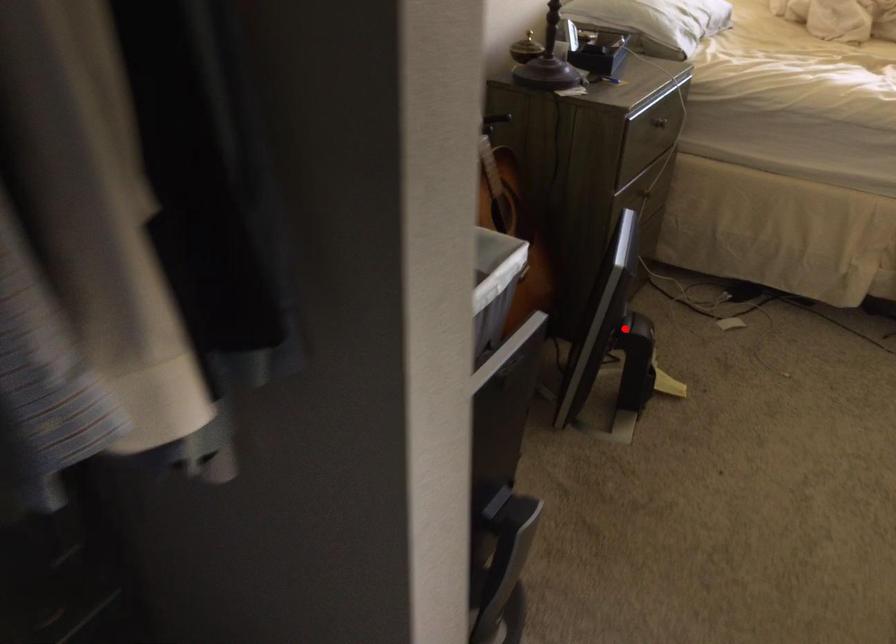
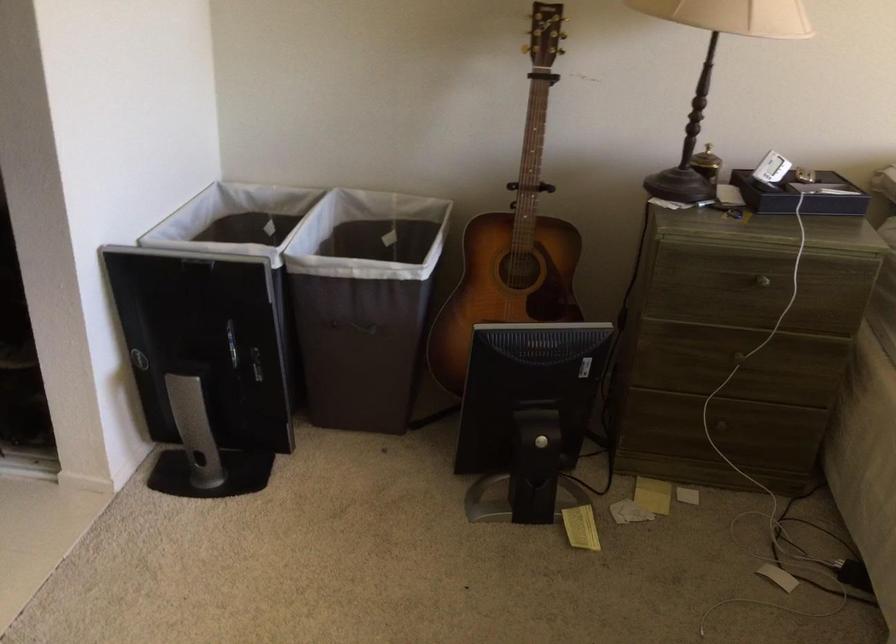
In the second image, find the point that corresponds to the highlighted location in the first image.

(528, 415)